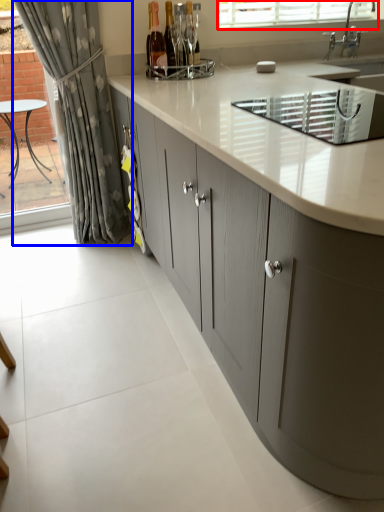
Question: Which point is closer to the camera, bay window (highlighted by a red box) or curtain (highlighted by a blue box)?

Choices:
 (A) bay window
 (B) curtain

Answer: (B)